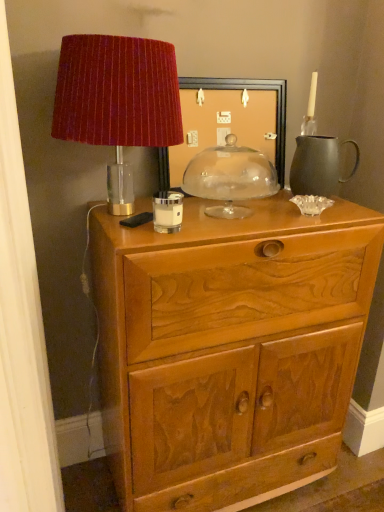
Question: Considering their positions, is matte black picture frame at center located in front of or behind transparent glass dome at center, the 2th candle holder positioned from the left?

Choices:
 (A) front
 (B) behind

Answer: (B)

Question: Is point (188, 139) closer or farther from the camera than point (226, 159)?

Choices:
 (A) closer
 (B) farther

Answer: (A)

Question: Which object is positioned farthest from the matte black pitcher at right?

Choices:
 (A) matte black picture frame at center
 (B) transparent glass dome at center, the 2th candle holder positioned from the left
 (C) white glass candle holder at center, which ranks as the 2th candle holder in right-to-left order
 (D) wooden carved chest of drawers at center
 (E) velvet red lampshade at upper left

Answer: (E)

Question: Which object is positioned farthest from the transparent glass dome at center, the first candle holder from the back?

Choices:
 (A) matte black picture frame at center
 (B) white glass candle holder at center, the second candle holder viewed from the back
 (C) wooden carved chest of drawers at center
 (D) matte black pitcher at right
 (E) velvet red lampshade at upper left

Answer: (C)